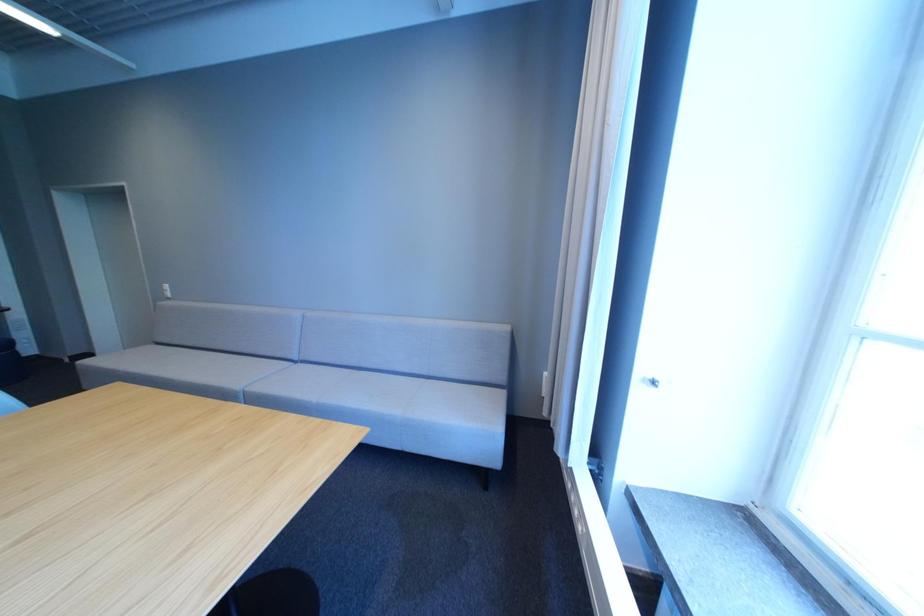
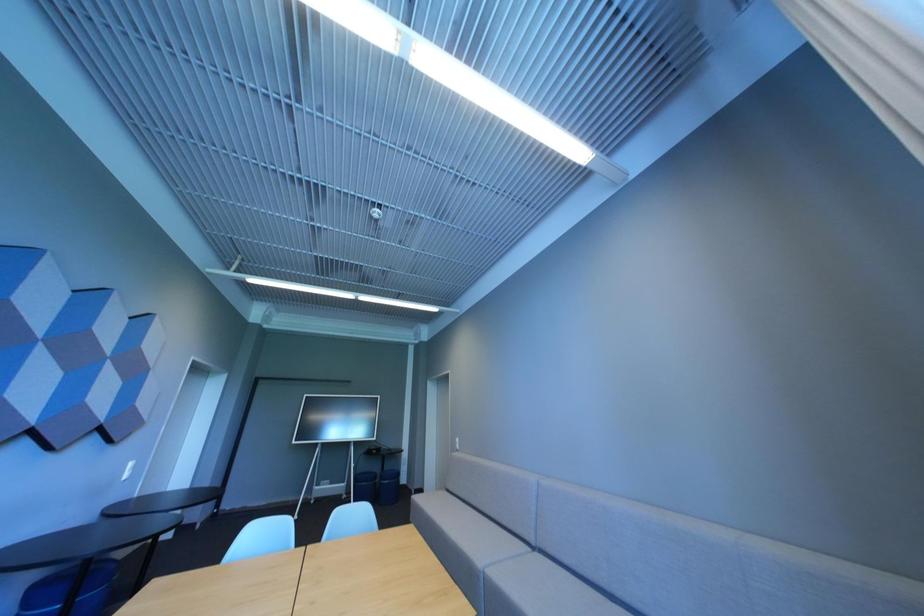
Based on the continuous images, in which direction is the camera rotating?

The camera rotated toward left-up.